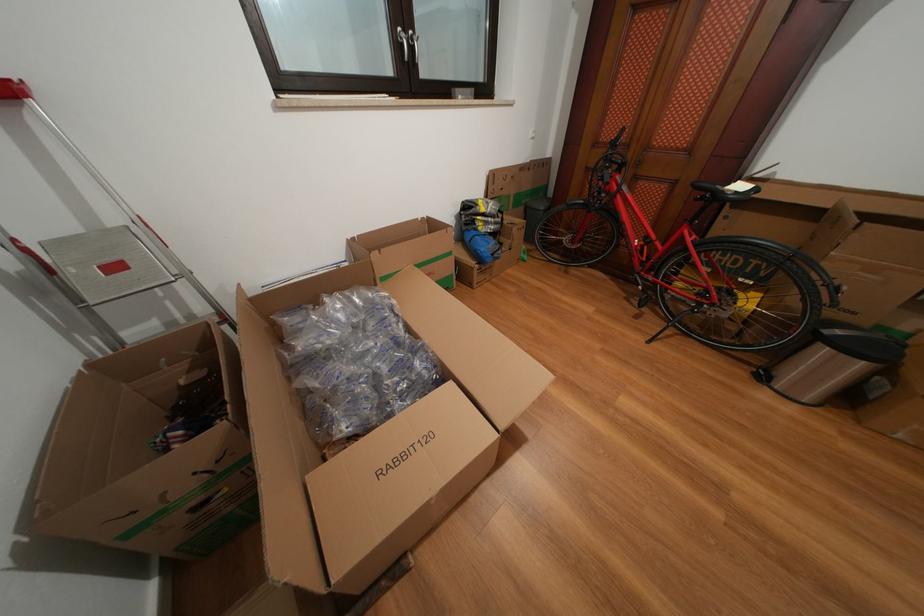
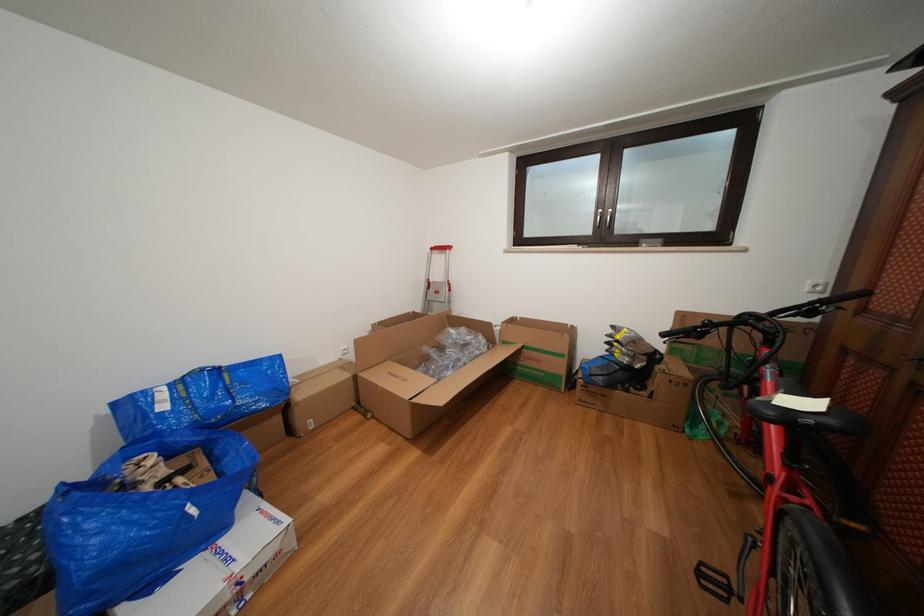
Locate, in the second image, the point that corresponds to [458,259] in the first image.

(570, 361)